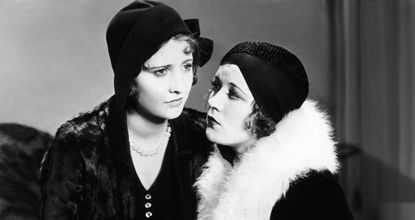
This screenshot has height=220, width=415. In order to click on curtains in this screenshot , I will do `click(366, 67)`.